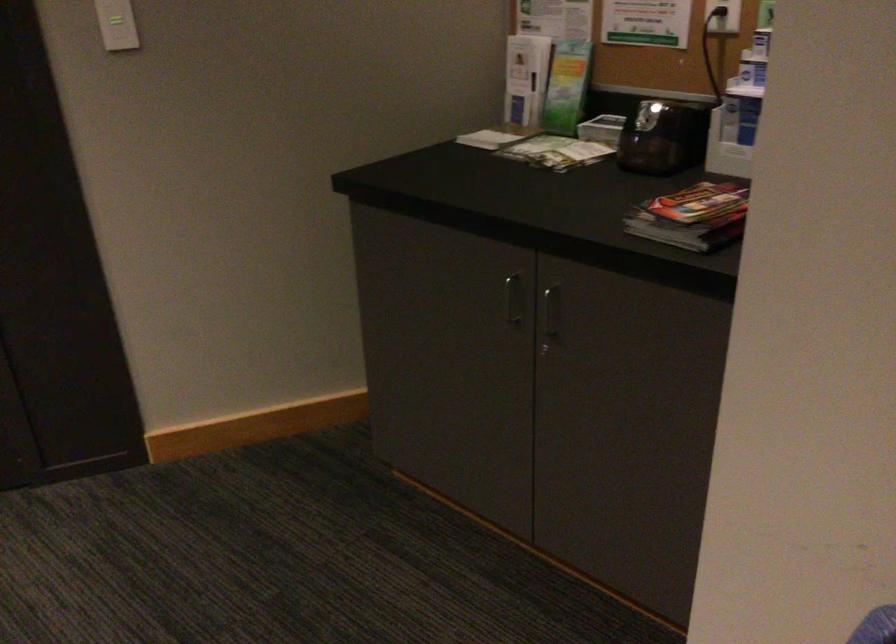
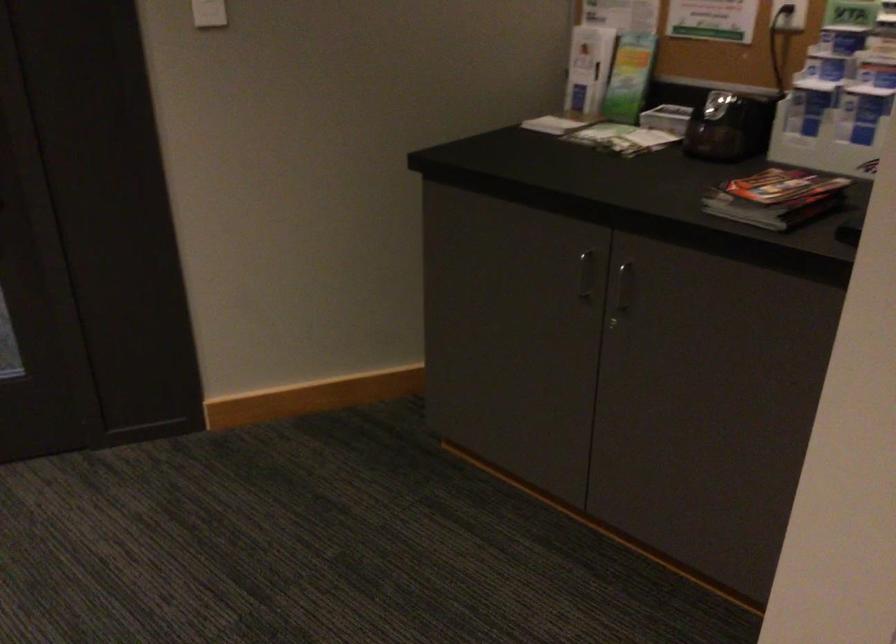
Locate, in the second image, the point that corresponds to [586,153] in the first image.

(647, 140)